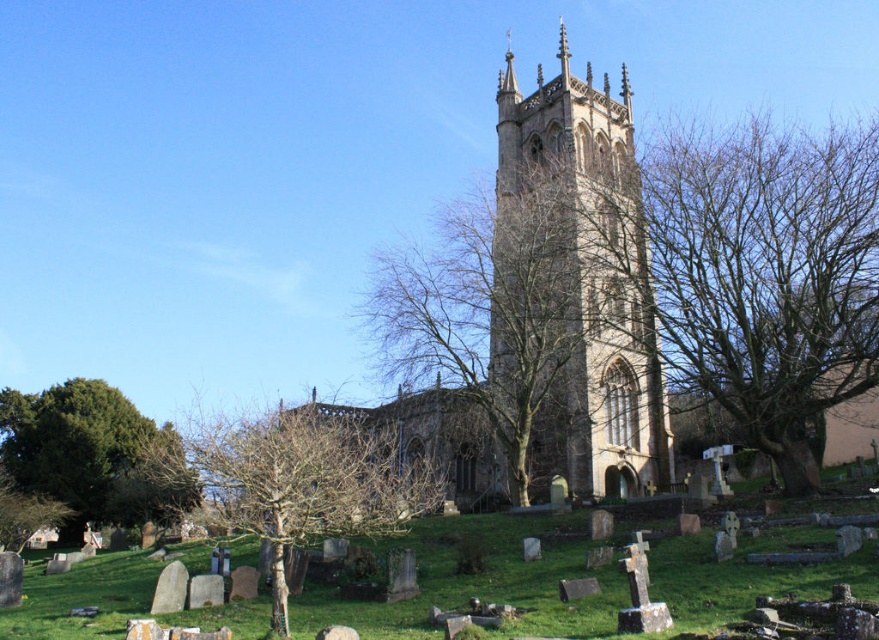
Is bare branches at lower left positioned before green leafy tree at lower left?

Yes, bare branches at lower left is in front of green leafy tree at lower left.

Is the position of bare branches at lower left more distant than that of green leafy tree at lower left?

No.

What do you see at coordinates (303, 481) in the screenshot? The height and width of the screenshot is (640, 879). I see `bare branches at lower left` at bounding box center [303, 481].

Identify the location of bare branches at lower left. This screenshot has width=879, height=640. (303, 481).

In the scene shown: Who is lower down, brown stone church at center or green leafy tree at lower left?

Positioned lower is green leafy tree at lower left.

Between point (491, 394) and point (12, 417), which one is positioned in front?

Positioned in front is point (491, 394).

Identify the location of brown stone church at center. (541, 298).

From the picture: Which is below, green grassy at center or green leafy tree at lower left?

green grassy at center

Which is above, green grassy at center or green leafy tree at lower left?

Positioned higher is green leafy tree at lower left.

You are a GUI agent. You are given a task and a screenshot of the screen. Output one action in this format:
    pyautogui.click(x=<x>, y=<y>)
    Task: Click on the green grassy at center
    The image size is (879, 640).
    Given the screenshot: What is the action you would take?
    pyautogui.click(x=481, y=580)